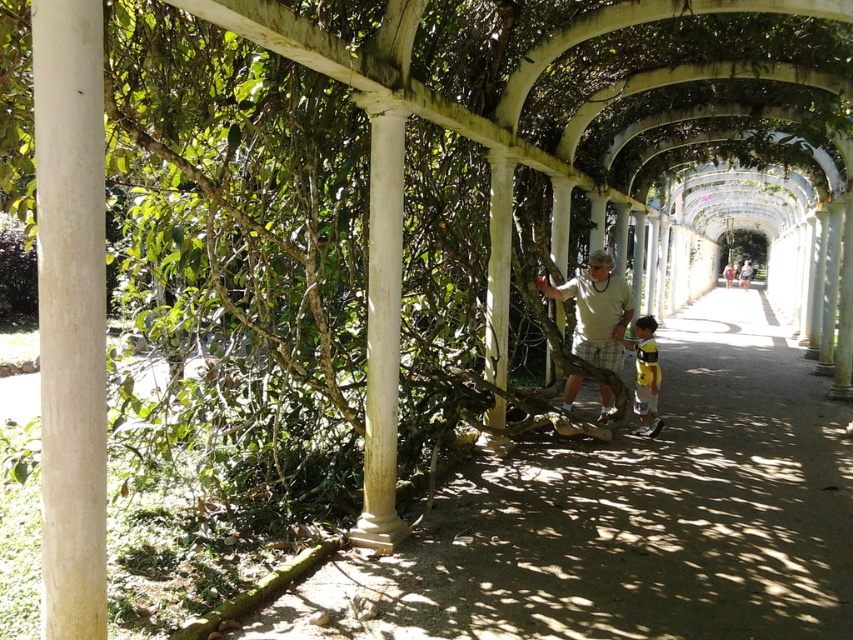
You are standing on the smooth concrete path at center and want to reach the white smooth column at left. Which direction should you move to get closer to the column?

You should move to the left because the smooth concrete path at center is below the white smooth column at left, indicating that the column is positioned to the left of the path.

What is located at the coordinates point (70, 314) in the image?

The coordinates point (70, 314) indicate the location of the white smooth column at left.